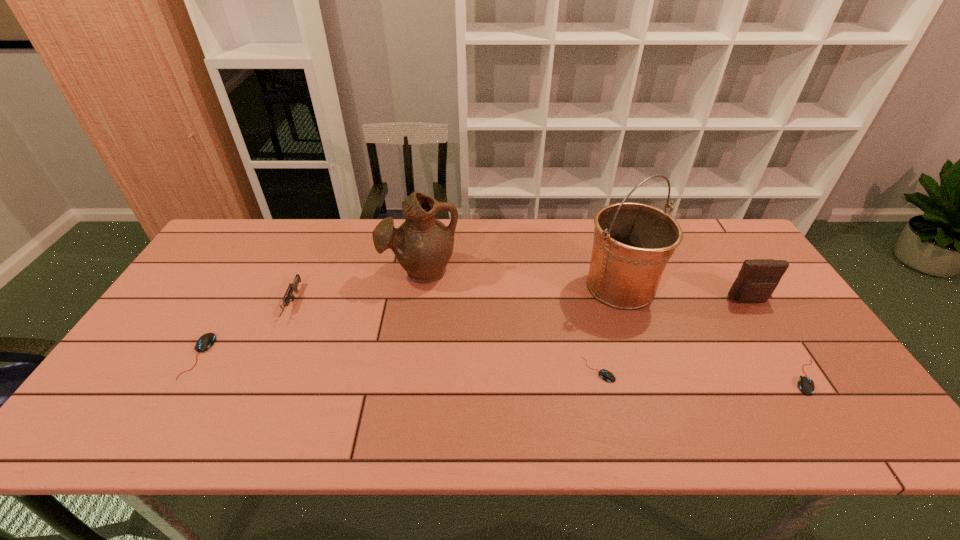
If we want them evenly spaced by inserting an extra mouse_(computer_equipment) among them, please locate a free spot for this new mouse_(computer_equipment). Please provide its 2D coordinates. Your answer should be formatted as a tuple, i.e. [(x, y)], where the tuple contains the x and y coordinates of a point satisfying the conditions above.

[(396, 363)]